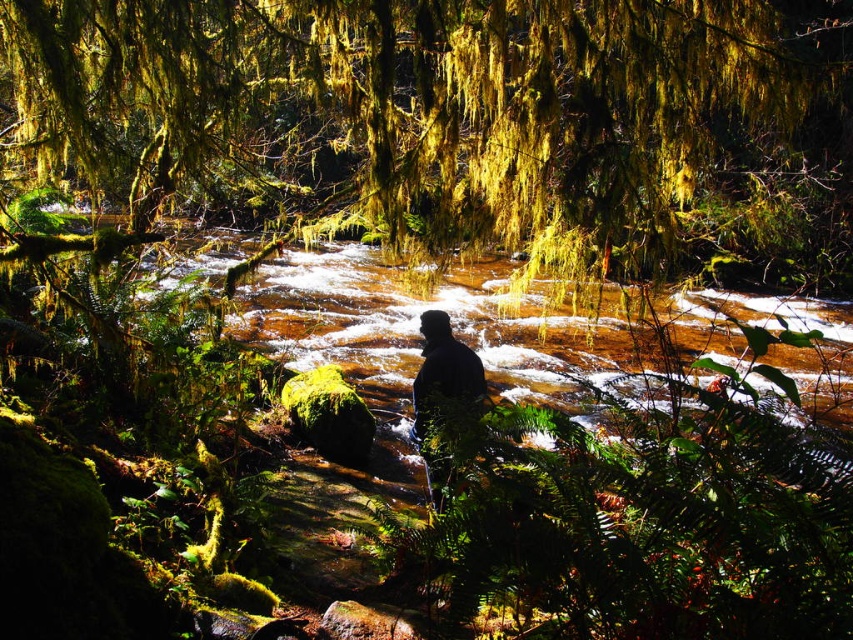
Question: Can you confirm if green mossy tree at center is positioned to the right of black matte person at center?

Choices:
 (A) yes
 (B) no

Answer: (A)

Question: Among these objects, which one is nearest to the camera?

Choices:
 (A) black matte person at center
 (B) green mossy tree at center

Answer: (B)

Question: Can you confirm if green mossy tree at center is smaller than black matte person at center?

Choices:
 (A) no
 (B) yes

Answer: (A)

Question: Can you confirm if green mossy tree at center is positioned to the left of black matte person at center?

Choices:
 (A) yes
 (B) no

Answer: (B)